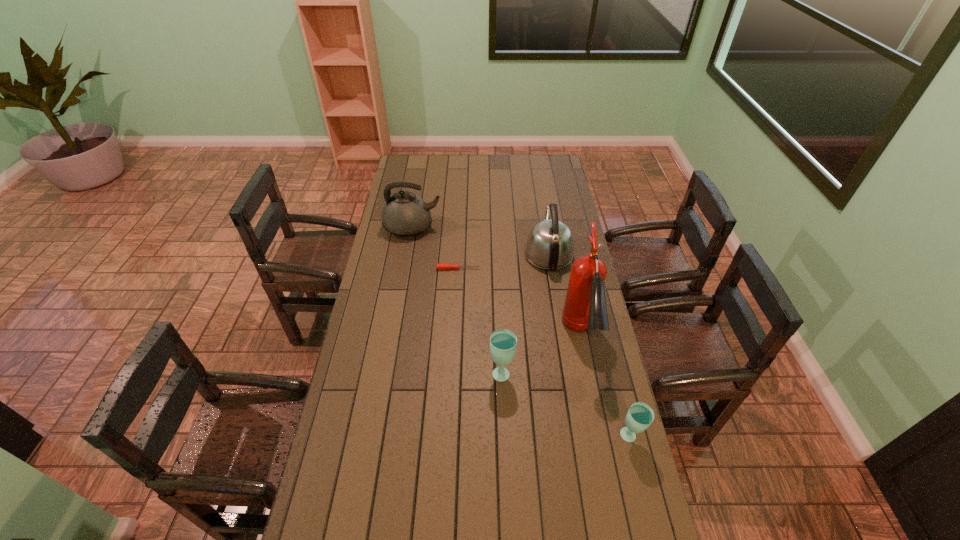
Locate an element on the screen. This screenshot has width=960, height=540. blank space located at the nozzle end of the fire extinguisher is located at coordinates (610, 481).

This screenshot has height=540, width=960. Find the location of `vacant point located at the tip of the shortest object`. vacant point located at the tip of the shortest object is located at coordinates (534, 268).

You are a GUI agent. You are given a task and a screenshot of the screen. Output one action in this format:
    pyautogui.click(x=<x>, y=<y>)
    Task: Click on the vacant area located 0.170m on the spout of the right kettle
    
    Given the screenshot: What is the action you would take?
    pyautogui.click(x=541, y=212)

This screenshot has height=540, width=960. I want to click on blank space located 0.290m on the spout of the right kettle, so click(x=540, y=198).

This screenshot has height=540, width=960. In order to click on vacant space situated 0.300m on the spout of the right kettle in this screenshot , I will do `click(539, 197)`.

Where is `free space located 0.380m at the spout of the left kettle`? free space located 0.380m at the spout of the left kettle is located at coordinates (522, 227).

Locate an element on the screen. The height and width of the screenshot is (540, 960). object positioned at the left edge is located at coordinates (405, 214).

Locate an element on the screen. glass that is positioned at the right edge is located at coordinates (640, 415).

Where is `fire extinguisher at the right edge`? The height and width of the screenshot is (540, 960). fire extinguisher at the right edge is located at coordinates (585, 308).

Locate an element on the screen. kettle that is at the right edge is located at coordinates (550, 245).